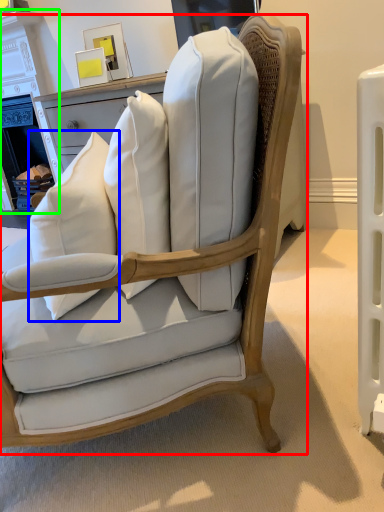
Question: Which object is the closest to the chair (highlighted by a red box)? Choose among these: throw pillow (highlighted by a blue box) or fireplace (highlighted by a green box).

Choices:
 (A) throw pillow
 (B) fireplace

Answer: (A)